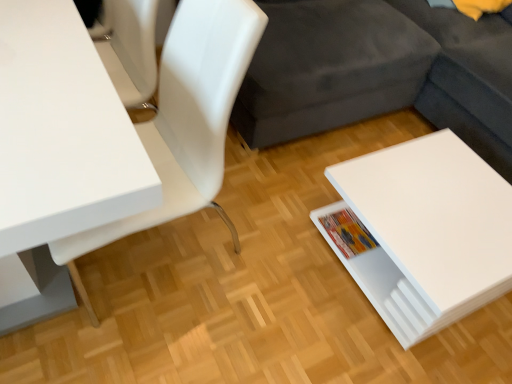
What do you see at coordinates (58, 154) in the screenshot? Image resolution: width=512 pixels, height=384 pixels. I see `white glossy table at left, the 1th table in the left-to-right sequence` at bounding box center [58, 154].

Locate an element on the screen. white glossy chair at upper left is located at coordinates (188, 116).

From the image's perspective, is white glossy chair at upper left above or below multicolored paper book at lower right?

white glossy chair at upper left is situated higher than multicolored paper book at lower right in the image.

How different are the orientations of white glossy chair at upper left and multicolored paper book at lower right in degrees?

The facing directions of white glossy chair at upper left and multicolored paper book at lower right are 88.6 degrees apart.

Where is `book below the white glossy chair at upper left (from a real-world perspective)`? book below the white glossy chair at upper left (from a real-world perspective) is located at coordinates (348, 233).

Considering the positions of point (161, 61) and point (335, 238), is point (161, 61) closer or farther from the camera than point (335, 238)?

Point (161, 61) is positioned farther from the camera compared to point (335, 238).

Between multicolored paper book at lower right and white glossy chair at upper left, which one has smaller width?

multicolored paper book at lower right.

How distant is multicolored paper book at lower right from white glossy chair at upper left?

The distance of multicolored paper book at lower right from white glossy chair at upper left is 76.35 centimeters.

Is multicolored paper book at lower right far away from white glossy chair at upper left?

That's not correct — multicolored paper book at lower right is a little close to white glossy chair at upper left.

Considering the positions of objects multicolored paper book at lower right and white glossy chair at upper left in the image provided, who is more to the right, multicolored paper book at lower right or white glossy chair at upper left?

multicolored paper book at lower right is more to the right.

Considering the sizes of objects white glossy table at left, placed as the second table when sorted from right to left, and white glossy table at lower right, marked as the 2th table in a left-to-right arrangement, in the image provided, who is smaller, white glossy table at left, placed as the second table when sorted from right to left, or white glossy table at lower right, marked as the 2th table in a left-to-right arrangement,?

Smaller between the two is white glossy table at lower right, marked as the 2th table in a left-to-right arrangement.

Can you confirm if white glossy table at left, the 1th table in the left-to-right sequence, is wider than white glossy table at lower right, marked as the 2th table in a left-to-right arrangement?

Yes, white glossy table at left, the 1th table in the left-to-right sequence, is wider than white glossy table at lower right, marked as the 2th table in a left-to-right arrangement.

Does white glossy table at left, the 1th table in the left-to-right sequence, appear on the left side of white glossy table at lower right, marked as the 2th table in a left-to-right arrangement?

Correct, you'll find white glossy table at left, the 1th table in the left-to-right sequence, to the left of white glossy table at lower right, marked as the 2th table in a left-to-right arrangement.

Is white glossy table at left, placed as the second table when sorted from right to left, taller than white glossy table at lower right, the first table from the right?

Yes.

Which object is further away from the camera taking this photo, multicolored paper book at lower right or white glossy table at lower right, the first table from the right?

multicolored paper book at lower right.

Identify the location of the 1st table located above the multicolored paper book at lower right (from a real-world perspective). (425, 232).

Considering the sizes of objects multicolored paper book at lower right and white glossy table at lower right, marked as the 2th table in a left-to-right arrangement, in the image provided, who is shorter, multicolored paper book at lower right or white glossy table at lower right, marked as the 2th table in a left-to-right arrangement,?

multicolored paper book at lower right.

Considering the relative sizes of multicolored paper book at lower right and white glossy table at lower right, the first table from the right, in the image provided, is multicolored paper book at lower right wider than white glossy table at lower right, the first table from the right,?

No.

Locate an element on the screen. table above the multicolored paper book at lower right (from the image's perspective) is located at coordinates (58, 154).

Considering the positions of objects white glossy table at left, the 1th table in the left-to-right sequence, and multicolored paper book at lower right in the image provided, who is more to the left, white glossy table at left, the 1th table in the left-to-right sequence, or multicolored paper book at lower right?

From the viewer's perspective, white glossy table at left, the 1th table in the left-to-right sequence, appears more on the left side.

Who is shorter, white glossy table at left, placed as the second table when sorted from right to left, or multicolored paper book at lower right?

With less height is multicolored paper book at lower right.

Considering their positions, is white glossy table at lower right, the first table from the right, located in front of or behind white glossy chair at upper left?

Visually, white glossy table at lower right, the first table from the right, is located behind white glossy chair at upper left.

Does point (385, 303) come farther from viewer compared to point (219, 29)?

Yes, it is.

Could you measure the distance between white glossy table at lower right, the first table from the right, and white glossy chair at upper left?

A distance of 28.64 inches exists between white glossy table at lower right, the first table from the right, and white glossy chair at upper left.

Is white glossy table at lower right, the first table from the right, next to white glossy chair at upper left?

No.

From the image's perspective, does white glossy table at lower right, the first table from the right, appear lower than white glossy table at left, the 1th table in the left-to-right sequence?

Yes, from the image's perspective, white glossy table at lower right, the first table from the right, is below white glossy table at left, the 1th table in the left-to-right sequence.

Considering the sizes of objects white glossy table at lower right, marked as the 2th table in a left-to-right arrangement, and white glossy table at left, placed as the second table when sorted from right to left, in the image provided, who is smaller, white glossy table at lower right, marked as the 2th table in a left-to-right arrangement, or white glossy table at left, placed as the second table when sorted from right to left,?

Smaller between the two is white glossy table at lower right, marked as the 2th table in a left-to-right arrangement.

Considering the positions of objects white glossy table at lower right, the first table from the right, and white glossy table at left, the 1th table in the left-to-right sequence, in the image provided, who is more to the left, white glossy table at lower right, the first table from the right, or white glossy table at left, the 1th table in the left-to-right sequence,?

white glossy table at left, the 1th table in the left-to-right sequence.

Can we say white glossy table at lower right, the first table from the right, lies outside white glossy table at left, the 1th table in the left-to-right sequence?

That's correct, white glossy table at lower right, the first table from the right, is outside of white glossy table at left, the 1th table in the left-to-right sequence.

The width and height of the screenshot is (512, 384). I want to click on chair on the left of multicolored paper book at lower right, so click(x=188, y=116).

Where is `book lying on the right of white glossy chair at upper left`? This screenshot has height=384, width=512. book lying on the right of white glossy chair at upper left is located at coordinates (348, 233).

From the image, which object appears to be nearer to white glossy table at lower right, the first table from the right, white glossy table at left, placed as the second table when sorted from right to left, or white glossy chair at upper left?

white glossy chair at upper left is positioned closer to the anchor white glossy table at lower right, the first table from the right.

Based on their spatial positions, is white glossy table at lower right, the first table from the right, or white glossy chair at upper left closer to multicolored paper book at lower right?

white glossy table at lower right, the first table from the right.

In the scene shown: Considering their positions, is white glossy table at lower right, marked as the 2th table in a left-to-right arrangement, positioned closer to white glossy chair at upper left than multicolored paper book at lower right?

white glossy table at lower right, marked as the 2th table in a left-to-right arrangement.

Looking at the image, which one is located closer to multicolored paper book at lower right, white glossy table at left, placed as the second table when sorted from right to left, or white glossy chair at upper left?

Among the two, white glossy chair at upper left is located nearer to multicolored paper book at lower right.

In the scene shown: From the image, which object appears to be farther from white glossy table at left, placed as the second table when sorted from right to left, white glossy table at lower right, marked as the 2th table in a left-to-right arrangement, or multicolored paper book at lower right?

Among the two, multicolored paper book at lower right is located further to white glossy table at left, placed as the second table when sorted from right to left.

From the image, which object appears to be nearer to multicolored paper book at lower right, white glossy table at left, placed as the second table when sorted from right to left, or white glossy table at lower right, marked as the 2th table in a left-to-right arrangement?

Based on the image, white glossy table at lower right, marked as the 2th table in a left-to-right arrangement, appears to be nearer to multicolored paper book at lower right.

When comparing their distances from white glossy table at lower right, marked as the 2th table in a left-to-right arrangement, does white glossy chair at upper left or multicolored paper book at lower right seem further?

The object further to white glossy table at lower right, marked as the 2th table in a left-to-right arrangement, is white glossy chair at upper left.

From the image, which object appears to be nearer to white glossy table at lower right, marked as the 2th table in a left-to-right arrangement, white glossy table at left, the 1th table in the left-to-right sequence, or multicolored paper book at lower right?

Based on the image, multicolored paper book at lower right appears to be nearer to white glossy table at lower right, marked as the 2th table in a left-to-right arrangement.

Find the location of a particular element. Image resolution: width=512 pixels, height=384 pixels. chair situated between white glossy table at left, placed as the second table when sorted from right to left, and multicolored paper book at lower right from left to right is located at coordinates (188, 116).

Identify the location of book between white glossy table at left, placed as the second table when sorted from right to left, and white glossy table at lower right, marked as the 2th table in a left-to-right arrangement, in the horizontal direction. This screenshot has height=384, width=512. (348, 233).

Where is `chair located between white glossy table at left, the 1th table in the left-to-right sequence, and white glossy table at lower right, marked as the 2th table in a left-to-right arrangement, in the left-right direction`? chair located between white glossy table at left, the 1th table in the left-to-right sequence, and white glossy table at lower right, marked as the 2th table in a left-to-right arrangement, in the left-right direction is located at coordinates (188, 116).

Identify the location of book situated between white glossy chair at upper left and white glossy table at lower right, marked as the 2th table in a left-to-right arrangement, from left to right. (348, 233).